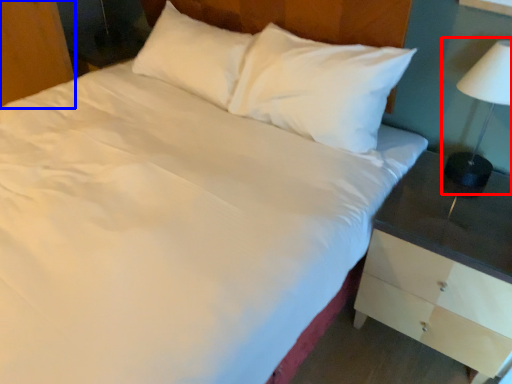
Question: Which of the following is the closest to the observer, bedside lamp (highlighted by a red box) or dresser (highlighted by a blue box)?

Choices:
 (A) bedside lamp
 (B) dresser

Answer: (A)